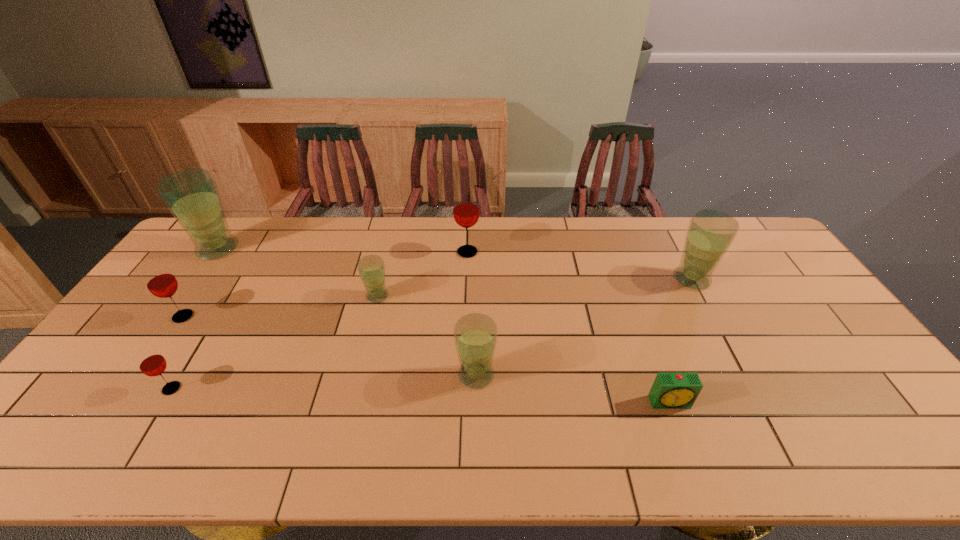
Where is `the fourth glass from left to right`? the fourth glass from left to right is located at coordinates (371, 268).

Find the location of `the smallest blue glass`. the smallest blue glass is located at coordinates (371, 268).

Image resolution: width=960 pixels, height=540 pixels. In order to click on the smallest red glass in this screenshot , I will do `click(151, 363)`.

I want to click on the third glass from left to right, so click(x=151, y=363).

In order to click on green alarm clock in this screenshot , I will do tap(671, 390).

At what (x,y) coordinates should I click in order to perform the action: click on the second object from right to left. Please return your answer as a coordinate pair (x, y). The height and width of the screenshot is (540, 960). Looking at the image, I should click on (671, 390).

Where is `free spot located 0.330m on the right of the farthest blue glass`? Image resolution: width=960 pixels, height=540 pixels. free spot located 0.330m on the right of the farthest blue glass is located at coordinates (335, 249).

This screenshot has width=960, height=540. What are the coordinates of `free spot located 0.200m on the left of the farthest red glass` in the screenshot? It's located at pos(396,252).

Identify the location of free space located on the left of the rightmost glass. This screenshot has width=960, height=540. (646, 279).

I want to click on free spot located 0.360m on the front of the second biggest red glass, so click(x=97, y=443).